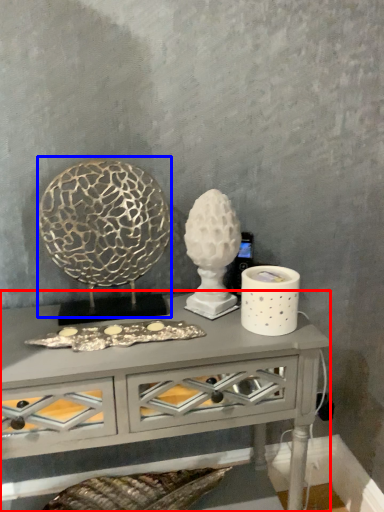
Question: Which object appears farthest to the camera in this image, table (highlighted by a red box) or sculpture (highlighted by a blue box)?

Choices:
 (A) table
 (B) sculpture

Answer: (B)